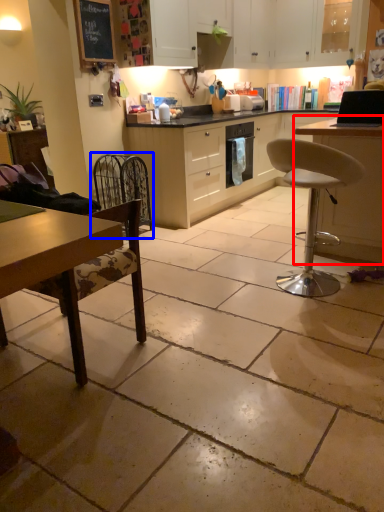
Question: Which object appears closest to the camera in this image, table (highlighted by a red box) or swivel chair (highlighted by a blue box)?

Choices:
 (A) table
 (B) swivel chair

Answer: (A)